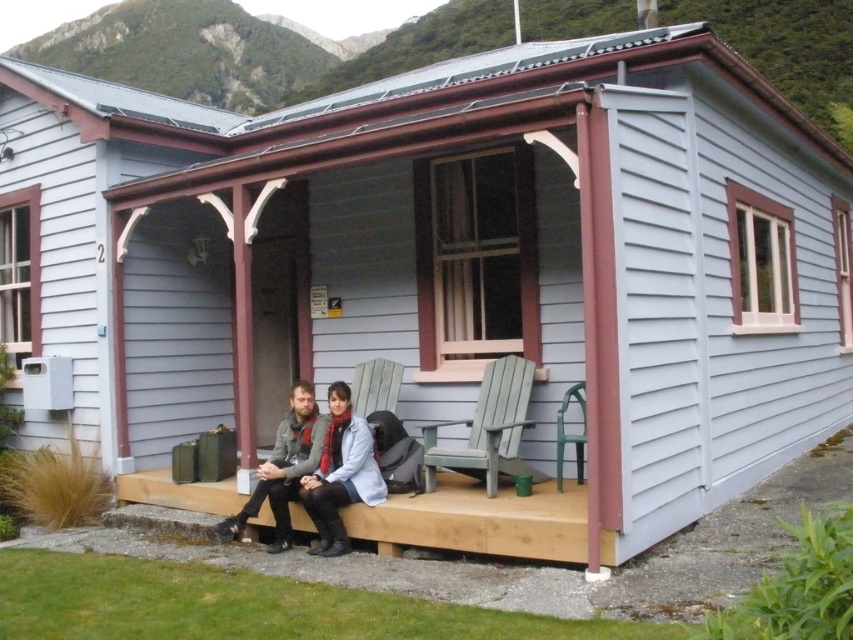
You are a guest at the cabin and want to sit on the wooden bench at center. However, you notice the matte gray jacket at center is already on it. Can you sit there without moving the jacket?

The wooden bench at center is shorter than the matte gray jacket at center, so the jacket is likely taking up the entire bench. You cannot sit there without moving the jacket.

You are planning to place a small potted plant between the wooden bench at center and the matte gray jacket at center on the porch. Based on their sizes, will the plant fit comfortably between them?

The wooden bench at center is wider than the matte gray jacket at center, so there should be enough space to place the potted plant between them comfortably.